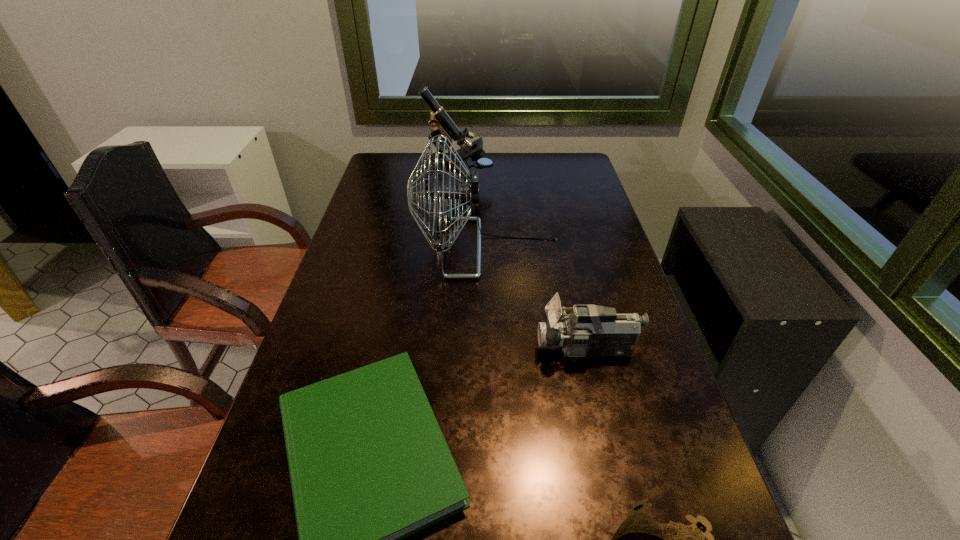
The image size is (960, 540). In order to click on the third closest object relative to the camcorder in this screenshot , I will do `click(690, 539)`.